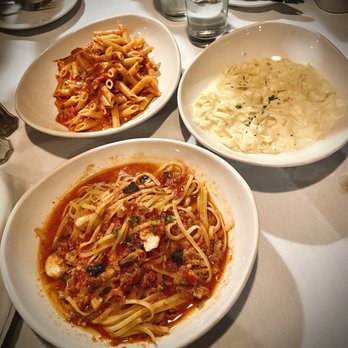
You are a GUI agent. You are given a task and a screenshot of the screen. Output one action in this format:
    pyautogui.click(x=<x>, y=<y>)
    Task: Click on the white table or countertop
    The image size is (348, 348).
    Given the screenshot: What is the action you would take?
    pyautogui.click(x=297, y=280)